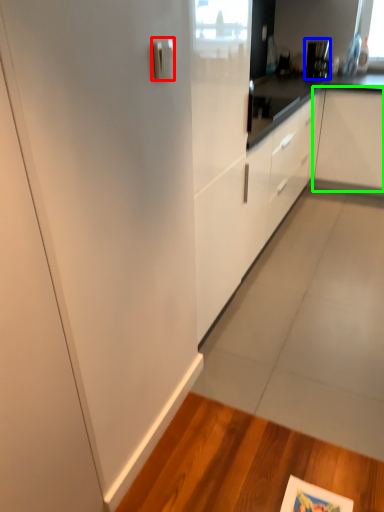
Question: Based on their relative distances, which object is farther from door handle (highlighted by a red box)? Choose from appliance (highlighted by a blue box) and cabinetry (highlighted by a green box).

Choices:
 (A) appliance
 (B) cabinetry

Answer: (A)